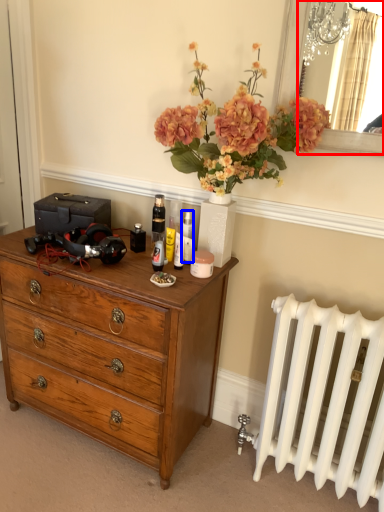
Question: Which object is closer to the camera taking this photo, mirror (highlighted by a red box) or toiletry (highlighted by a blue box)?

Choices:
 (A) mirror
 (B) toiletry

Answer: (A)